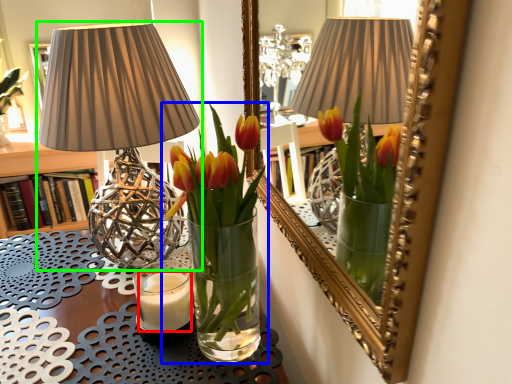
Question: Considering the real-world distances, which object is closest to candle (highlighted by a red box)? houseplant (highlighted by a blue box) or lamp (highlighted by a green box).

Choices:
 (A) houseplant
 (B) lamp

Answer: (A)